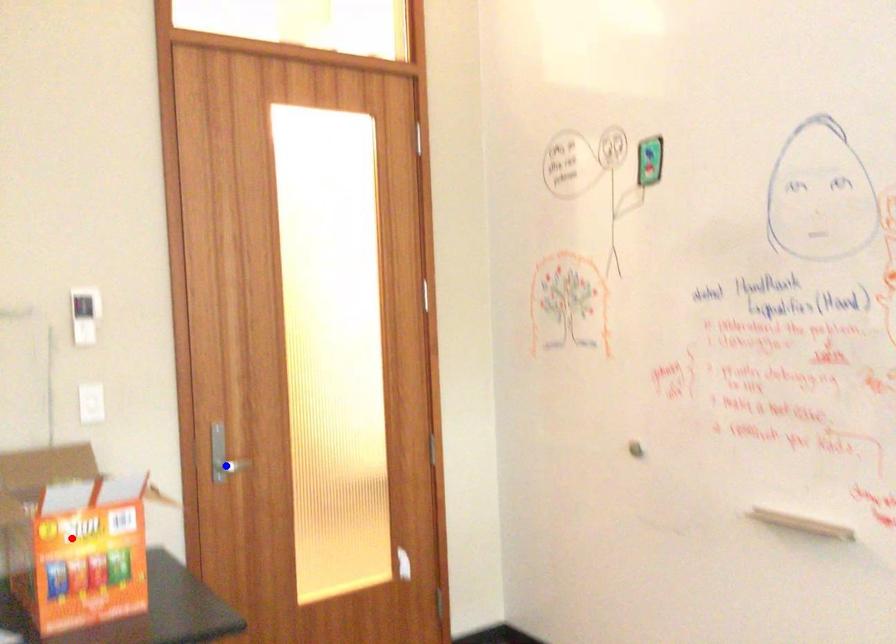
Question: Two points are marked on the image. Which point is closer to the camera?

Choices:
 (A) Blue point is closer.
 (B) Red point is closer.

Answer: (B)